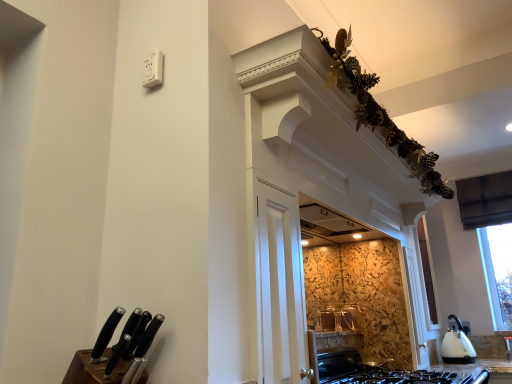
Question: Can you confirm if black matte knife at lower left, the second knife in the left-to-right sequence, is positioned to the right of brown wooden knife block at lower left?

Choices:
 (A) no
 (B) yes

Answer: (B)

Question: Does black matte knife at lower left, acting as the first knife starting from the right, have a greater height compared to brown wooden knife block at lower left?

Choices:
 (A) no
 (B) yes

Answer: (B)

Question: Is black matte knife at lower left, acting as the first knife starting from the right, next to brown wooden knife block at lower left and touching it?

Choices:
 (A) no
 (B) yes

Answer: (B)

Question: Is black matte knife at lower left, acting as the first knife starting from the right, aimed at brown wooden knife block at lower left?

Choices:
 (A) yes
 (B) no

Answer: (A)

Question: Is black matte knife at lower left, the second knife in the left-to-right sequence, completely or partially outside of brown wooden knife block at lower left?

Choices:
 (A) no
 (B) yes

Answer: (A)

Question: In the image, is black plastic knife at lower left, placed as the 1th knife when sorted from left to right, positioned in front of or behind brown wooden knife block at lower left?

Choices:
 (A) behind
 (B) front

Answer: (A)

Question: In terms of width, does black plastic knife at lower left, which is the 2th knife from right to left, look wider or thinner when compared to brown wooden knife block at lower left?

Choices:
 (A) thin
 (B) wide

Answer: (A)

Question: Is black plastic knife at lower left, placed as the 1th knife when sorted from left to right, taller or shorter than brown wooden knife block at lower left?

Choices:
 (A) short
 (B) tall

Answer: (B)

Question: Visually, is black plastic knife at lower left, which is the 2th knife from right to left, positioned to the left or to the right of brown wooden knife block at lower left?

Choices:
 (A) left
 (B) right

Answer: (B)

Question: Looking at their shapes, would you say white glossy electric kettle at lower right is wider or thinner than black matte knife at lower left, acting as the first knife starting from the right?

Choices:
 (A) wide
 (B) thin

Answer: (A)

Question: Would you say white glossy electric kettle at lower right is to the left or to the right of black matte knife at lower left, acting as the first knife starting from the right, in the picture?

Choices:
 (A) left
 (B) right

Answer: (B)

Question: Looking at the image, does white glossy electric kettle at lower right seem bigger or smaller compared to black matte knife at lower left, acting as the first knife starting from the right?

Choices:
 (A) small
 (B) big

Answer: (B)

Question: Is white glossy electric kettle at lower right situated inside black matte knife at lower left, the second knife in the left-to-right sequence, or outside?

Choices:
 (A) inside
 (B) outside

Answer: (B)

Question: Relative to white glossy electric kettle at lower right, is brown wooden knife block at lower left in front or behind?

Choices:
 (A) front
 (B) behind

Answer: (A)

Question: Is brown wooden knife block at lower left to the left or to the right of white glossy electric kettle at lower right in the image?

Choices:
 (A) right
 (B) left

Answer: (B)